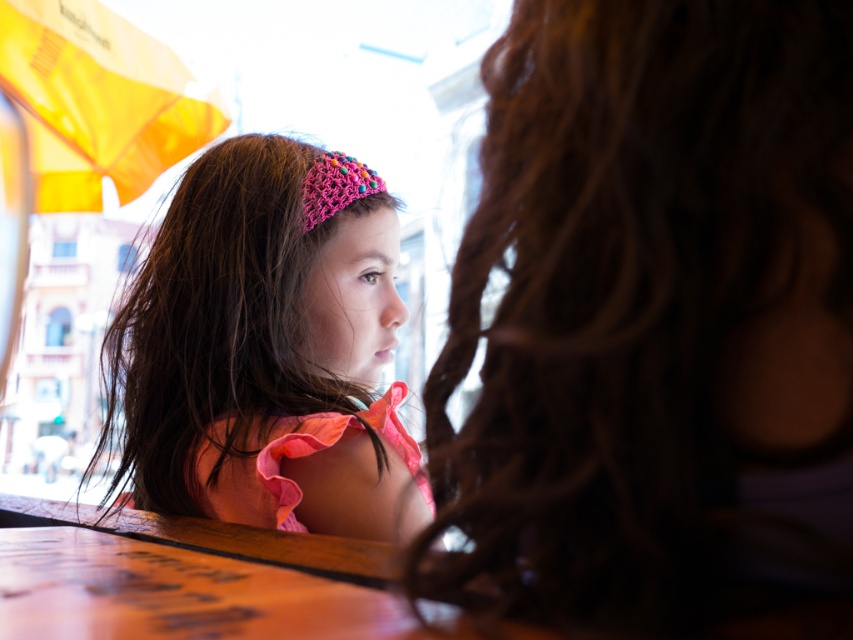
Question: Is dark brown curly hair at upper right to the left of pink knitted headband at upper center from the viewer's perspective?

Choices:
 (A) no
 (B) yes

Answer: (A)

Question: Can you confirm if dark brown curly hair at upper right is positioned above wooden table at lower center?

Choices:
 (A) no
 (B) yes

Answer: (B)

Question: Which point is farther from the camera taking this photo?

Choices:
 (A) (614, 173)
 (B) (154, 419)
 (C) (329, 204)

Answer: (C)

Question: Based on their relative distances, which object is farther from the wooden table at lower center?

Choices:
 (A) pink knitted headband at upper center
 (B) pink crochet headband at center

Answer: (A)

Question: Is the position of dark brown curly hair at upper right less distant than that of pink knitted headband at upper center?

Choices:
 (A) yes
 (B) no

Answer: (A)

Question: Which object appears closest to the camera in this image?

Choices:
 (A) pink knitted headband at upper center
 (B) wooden table at lower center

Answer: (B)